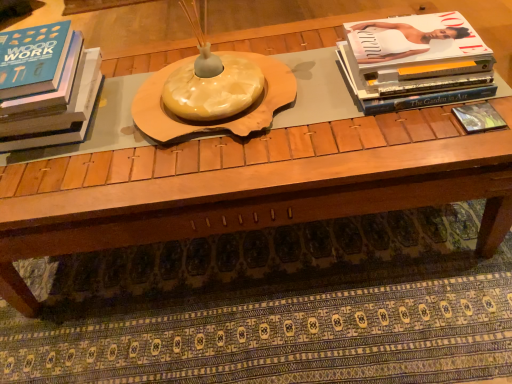
Question: Is matte black book at left, which appears as the third book when viewed from the right, surrounding matte black book at right, marked as the third book in a left-to-right arrangement?

Choices:
 (A) yes
 (B) no

Answer: (B)

Question: Is matte black book at left, acting as the 1th book starting from the left, taller than matte black book at right, marked as the third book in a left-to-right arrangement?

Choices:
 (A) yes
 (B) no

Answer: (A)

Question: Does matte black book at left, which appears as the third book when viewed from the right, appear on the right side of matte black book at right, the first book in the right-to-left sequence?

Choices:
 (A) yes
 (B) no

Answer: (B)

Question: Is matte black book at left, acting as the 1th book starting from the left, bigger than matte black book at right, marked as the third book in a left-to-right arrangement?

Choices:
 (A) no
 (B) yes

Answer: (B)

Question: Is matte black book at right, marked as the third book in a left-to-right arrangement, at the back of matte black book at left, acting as the 1th book starting from the left?

Choices:
 (A) no
 (B) yes

Answer: (A)

Question: In the image, is matte white book at upper right, the second book positioned from the left, on the left side or the right side of matte black book at right, marked as the third book in a left-to-right arrangement?

Choices:
 (A) left
 (B) right

Answer: (A)

Question: From a real-world perspective, is matte white book at upper right, the second book positioned from the left, positioned above or below matte black book at right, the first book in the right-to-left sequence?

Choices:
 (A) above
 (B) below

Answer: (A)

Question: Considering the positions of matte white book at upper right, the second book positioned from the left, and matte black book at right, marked as the third book in a left-to-right arrangement, in the image, is matte white book at upper right, the second book positioned from the left, wider or thinner than matte black book at right, marked as the third book in a left-to-right arrangement,?

Choices:
 (A) wide
 (B) thin

Answer: (A)

Question: From the image's perspective, is matte white book at upper right, the second book positioned from the left, located above or below matte black book at right, marked as the third book in a left-to-right arrangement?

Choices:
 (A) above
 (B) below

Answer: (A)

Question: Is matte black book at right, the first book in the right-to-left sequence, spatially inside matte white book at upper right, the second book positioned from the left, or outside of it?

Choices:
 (A) outside
 (B) inside

Answer: (A)

Question: Is matte black book at right, marked as the third book in a left-to-right arrangement, taller or shorter than matte white book at upper right, the second book positioned from the left?

Choices:
 (A) tall
 (B) short

Answer: (B)

Question: Based on their sizes in the image, would you say matte black book at right, the first book in the right-to-left sequence, is bigger or smaller than matte white book at upper right, the second book positioned from the left?

Choices:
 (A) big
 (B) small

Answer: (B)

Question: From the image's perspective, is matte black book at right, marked as the third book in a left-to-right arrangement, above or below matte white book at upper right, the 2th book when ordered from right to left?

Choices:
 (A) above
 (B) below

Answer: (B)

Question: Is matte black book at right, the first book in the right-to-left sequence, in front of or behind matte black book at left, acting as the 1th book starting from the left, in the image?

Choices:
 (A) behind
 (B) front

Answer: (A)

Question: Considering the positions of matte black book at right, the first book in the right-to-left sequence, and matte black book at left, which appears as the third book when viewed from the right, in the image, is matte black book at right, the first book in the right-to-left sequence, wider or thinner than matte black book at left, which appears as the third book when viewed from the right,?

Choices:
 (A) thin
 (B) wide

Answer: (A)